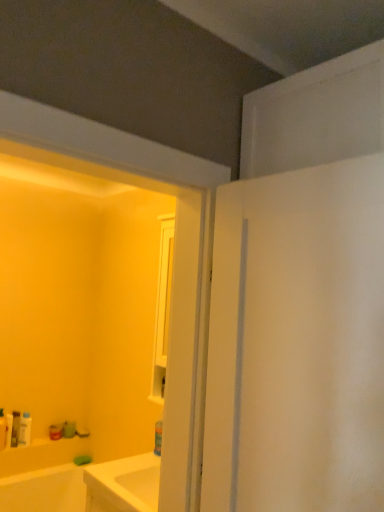
Question: In terms of height, does matte white tube at lower left, the fourth toiletry from the right, look taller or shorter compared to matte white bottle at lower left, which ranks as the 5th toiletry in right-to-left order?

Choices:
 (A) short
 (B) tall

Answer: (A)

Question: Would you say matte white tube at lower left, the fourth toiletry from the right, is inside or outside matte white bottle at lower left, which ranks as the 5th toiletry in right-to-left order?

Choices:
 (A) inside
 (B) outside

Answer: (B)

Question: Based on their relative distances, which object is nearer to the matte white bottle at lower left, which ranks as the 5th toiletry in right-to-left order?

Choices:
 (A) matte white tube at lower left, the second toiletry in the left-to-right sequence
 (B) white plastic bottle at lower left, positioned as the 3th toiletry in left-to-right order
 (C) white plastic bottle at lower left, the 2th toiletry in the right-to-left sequence
 (D) matte green soap at lower left, the fifth toiletry viewed from the left

Answer: (A)

Question: Which is farther from the white plastic bottle at lower left, positioned as the 3th toiletry in left-to-right order?

Choices:
 (A) white plastic bottle at lower left, the fourth toiletry when ordered from left to right
 (B) matte white tube at lower left, the fourth toiletry from the right
 (C) matte white bottle at lower left, which ranks as the 5th toiletry in right-to-left order
 (D) matte green soap at lower left, the fifth toiletry viewed from the left

Answer: (D)